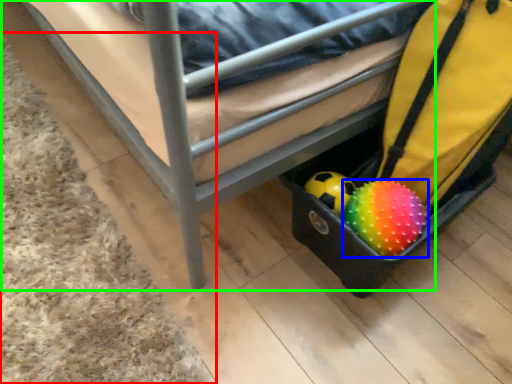
Question: Which object is the farthest from mat (highlighted by a red box)? Choose among these: ball (highlighted by a blue box) or furniture (highlighted by a green box).

Choices:
 (A) ball
 (B) furniture

Answer: (A)